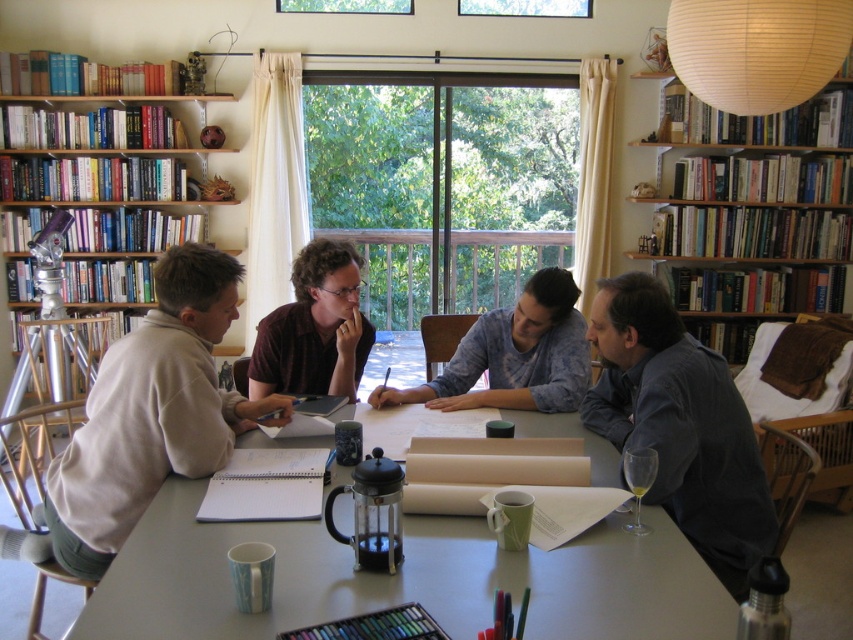
Based on the photo, can you confirm if wooden bookshelf at upper right is shorter than wooden bookshelf at upper left?

In fact, wooden bookshelf at upper right may be taller than wooden bookshelf at upper left.

Can you confirm if wooden bookshelf at upper right is bigger than wooden bookshelf at upper left?

Yes.

Is point (784, 161) closer to viewer compared to point (82, 76)?

No, (784, 161) is behind (82, 76).

Locate an element on the screen. The image size is (853, 640). wooden bookshelf at upper right is located at coordinates (759, 150).

Is point (583, 376) positioned before point (346, 307)?

No, it is behind (346, 307).

Describe the element at coordinates (514, 355) in the screenshot. I see `light blue cotton shirt at center` at that location.

Between point (370, 394) and point (337, 353), which one is positioned behind?

The point (337, 353) is behind.

Locate an element on the screen. The width and height of the screenshot is (853, 640). light blue cotton shirt at center is located at coordinates (514, 355).

Is dark blue shirt at lower right closer to camera compared to light blue cotton shirt at center?

Yes.

Who is higher up, dark blue shirt at lower right or light blue cotton shirt at center?

Positioned higher is light blue cotton shirt at center.

Between point (695, 547) and point (543, 282), which one is positioned behind?

Point (543, 282)

Where is `dark blue shirt at lower right`? dark blue shirt at lower right is located at coordinates (680, 424).